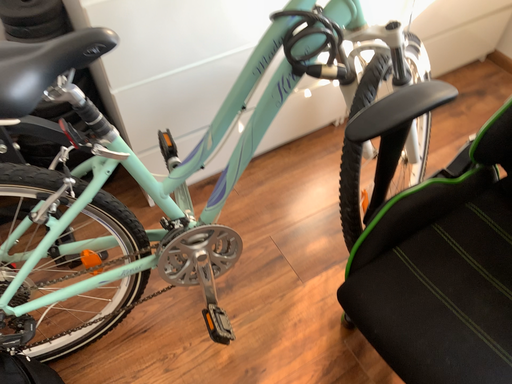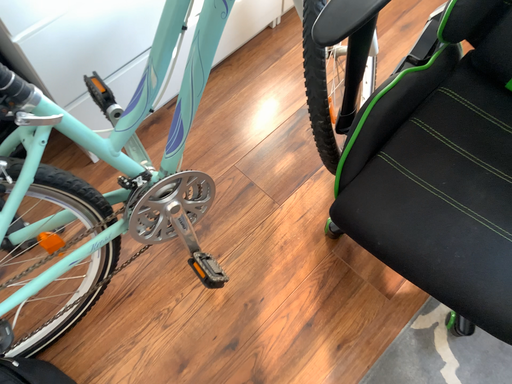
Question: Which way did the camera rotate in the video?

Choices:
 (A) rotated upward
 (B) rotated downward

Answer: (B)